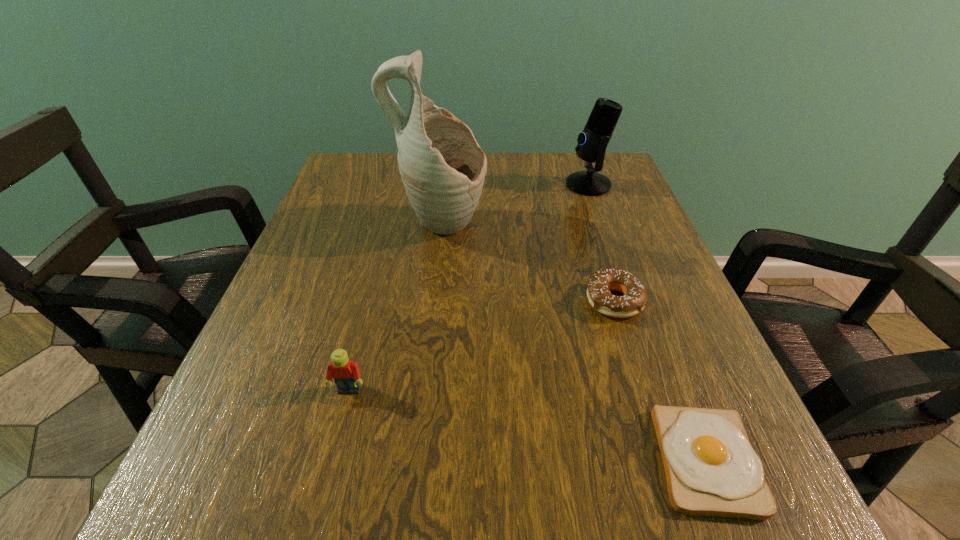
This screenshot has height=540, width=960. I want to click on vacant area that lies between the shortest object and the third farthest object, so click(660, 381).

At what (x,y) coordinates should I click in order to perform the action: click on free space between the second nearest object and the third farthest object. Please return your answer as a coordinate pair (x, y). Looking at the image, I should click on (482, 346).

Locate an element on the screen. This screenshot has height=540, width=960. unoccupied area between the nearest object and the microphone is located at coordinates (647, 323).

The width and height of the screenshot is (960, 540). In order to click on blank region between the shortest object and the farthest object in this screenshot , I will do `click(647, 323)`.

Locate an element on the screen. This screenshot has width=960, height=540. vacant area between the third nearest object and the second tallest object is located at coordinates (601, 242).

Identify the location of vacant space that is in between the doughnut and the shortest object. (660, 381).

Locate an element on the screen. vacant point located between the third nearest object and the farthest object is located at coordinates (601, 242).

You are a GUI agent. You are given a task and a screenshot of the screen. Output one action in this format:
    pyautogui.click(x=<x>, y=<y>)
    Task: Click on the vacant point located between the fourth nearest object and the microphone
    
    Given the screenshot: What is the action you would take?
    pyautogui.click(x=515, y=206)

The image size is (960, 540). What are the coordinates of `empty location between the toast and the doughnut` in the screenshot? It's located at (660, 381).

Image resolution: width=960 pixels, height=540 pixels. In order to click on vacant area between the third tallest object and the tallest object in this screenshot , I will do `click(395, 309)`.